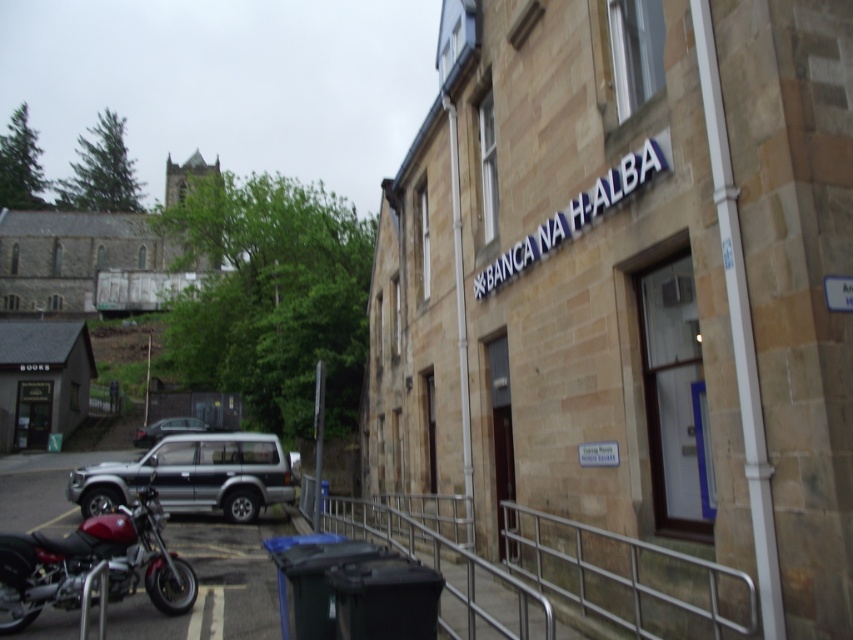
Question: Which point appears closest to the camera in this image?

Choices:
 (A) (189, 428)
 (B) (260, 492)
 (C) (402, 536)

Answer: (C)

Question: Can you confirm if silver metallic rail at lower center is positioned to the right of shiny red motorcycle at lower left?

Choices:
 (A) no
 (B) yes

Answer: (B)

Question: Is shiny red motorcycle at lower left above silver metallic suv at lower left?

Choices:
 (A) yes
 (B) no

Answer: (A)

Question: Can you confirm if silver metallic suv at lower left is positioned to the right of metallic silver car at center-left?

Choices:
 (A) no
 (B) yes

Answer: (B)

Question: Which is farther from the metallic silver car at center-left?

Choices:
 (A) silver metallic suv at lower left
 (B) silver metallic rail at lower center

Answer: (B)

Question: Which object is farther from the camera taking this photo?

Choices:
 (A) metallic silver car at center-left
 (B) silver metallic suv at lower left

Answer: (A)